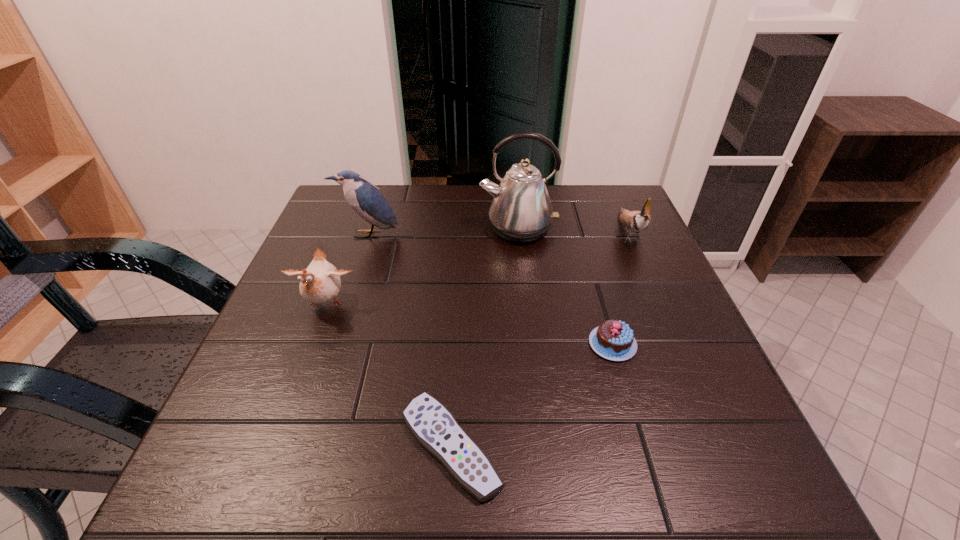
This screenshot has width=960, height=540. In order to click on blank area at the far edge in this screenshot , I will do `click(398, 211)`.

In the image, there is a desktop. Find the location of `vacant space at the near edge`. vacant space at the near edge is located at coordinates (628, 502).

In the image, there is a desktop. At what (x,y) coordinates should I click in order to perform the action: click on free space at the left edge. Please return your answer as a coordinate pair (x, y). This screenshot has width=960, height=540. Looking at the image, I should click on (345, 252).

In the image, there is a desktop. Where is `free space at the right edge`? This screenshot has width=960, height=540. free space at the right edge is located at coordinates (739, 442).

In the image, there is a desktop. Identify the location of vacant space at the far right corner. (597, 184).

Identify the location of empty space that is in between the fifth tallest object and the tallest bird. This screenshot has height=540, width=960. (491, 289).

This screenshot has height=540, width=960. What are the coordinates of `unoccupied area between the fifth tallest object and the fourth farthest object` in the screenshot? It's located at (468, 325).

Find the location of `free space that is in between the rightmost bird and the tallest object`. free space that is in between the rightmost bird and the tallest object is located at coordinates (573, 230).

At what (x,y) coordinates should I click in order to perform the action: click on vacant area that lies between the tallest object and the nearest object. Please return your answer as a coordinate pair (x, y). Looking at the image, I should click on (485, 338).

The height and width of the screenshot is (540, 960). Find the location of `free space between the tallest object and the shortest object`. free space between the tallest object and the shortest object is located at coordinates (485, 338).